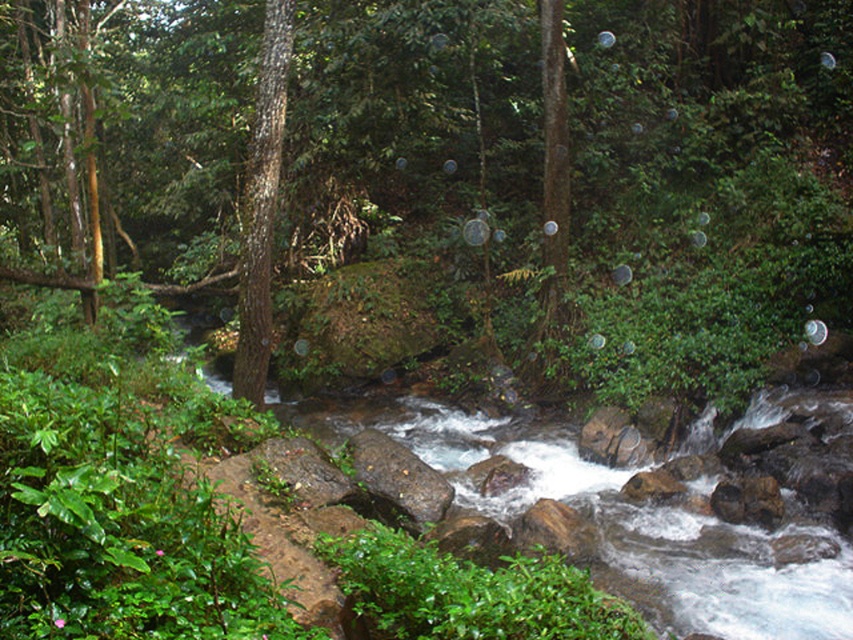
Measure the distance between green matte tree at center and smooth brown rock at center.

green matte tree at center and smooth brown rock at center are 8.26 meters apart from each other.

Is point (668, 205) behind point (368, 458)?

Yes, it is behind point (368, 458).

Is point (579, 212) in front of point (408, 452)?

No, it is not.

What are the coordinates of `green matte tree at center` in the screenshot? It's located at (595, 163).

Which of these two, green matte tree at center or brown rough bark tree at center, stands shorter?

brown rough bark tree at center

Is point (196, 218) closer to viewer compared to point (259, 77)?

That is False.

The width and height of the screenshot is (853, 640). What are the coordinates of `green matte tree at center` in the screenshot? It's located at (595, 163).

Is brown rough bark tree at center bigger than smooth brown rock at center?

Yes.

Identify the location of brown rough bark tree at center. (260, 204).

The width and height of the screenshot is (853, 640). I want to click on brown rough bark tree at center, so click(260, 204).